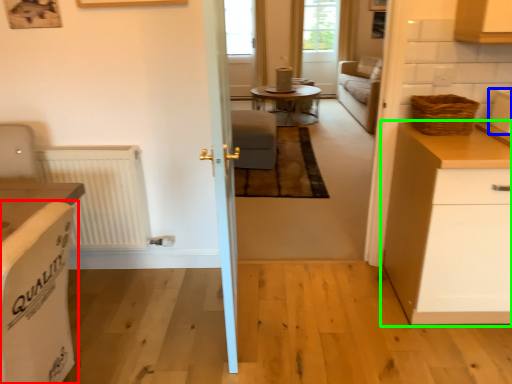
Question: Which object is the farthest from armchair (highlighted by a red box)? Choose among these: appliance (highlighted by a blue box) or cabinetry (highlighted by a green box).

Choices:
 (A) appliance
 (B) cabinetry

Answer: (A)